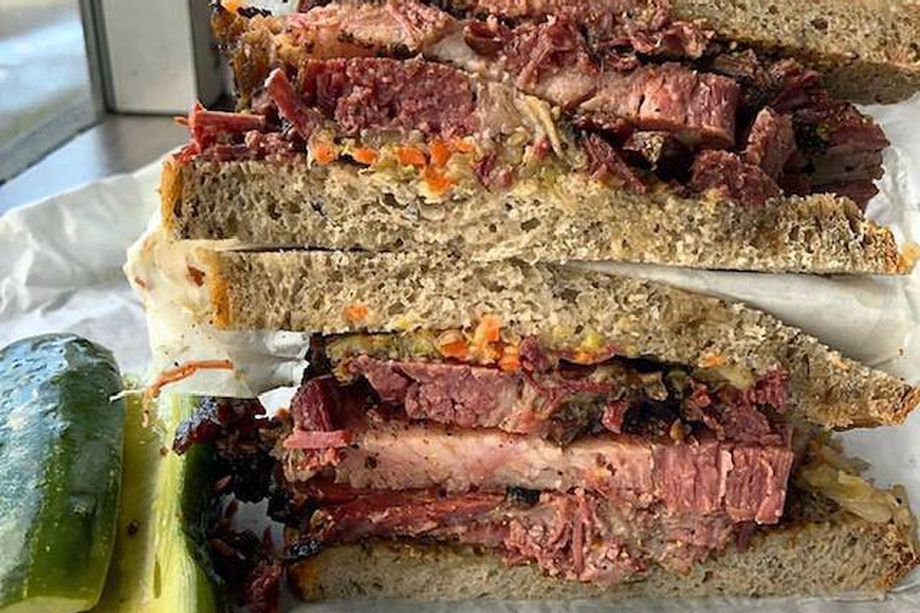
Locate an element on the screen. floor is located at coordinates (101, 146).